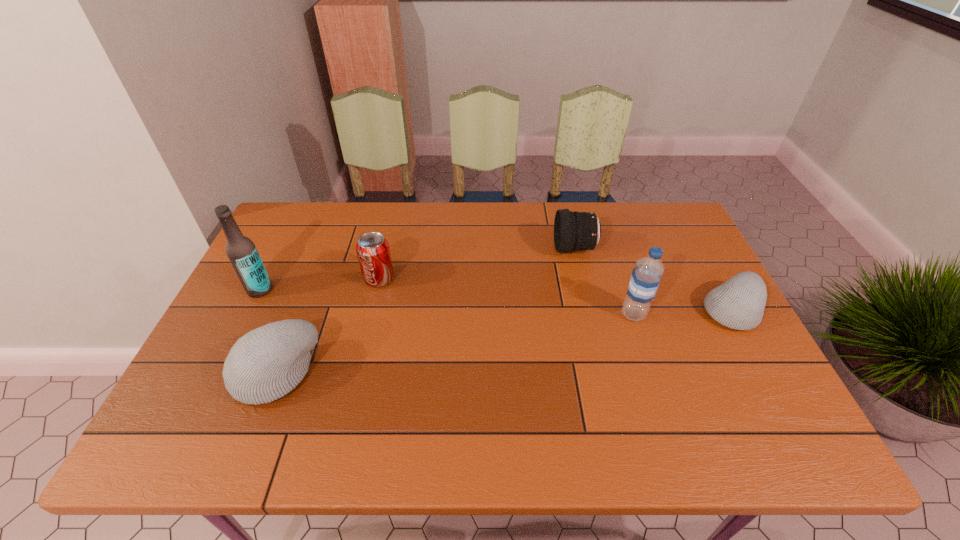
Image resolution: width=960 pixels, height=540 pixels. Find the location of `free space at the far left corner`. free space at the far left corner is located at coordinates (318, 232).

The height and width of the screenshot is (540, 960). I want to click on vacant position at the near left corner of the desktop, so click(216, 393).

The image size is (960, 540). I want to click on vacant space at the far right corner of the desktop, so click(x=645, y=245).

Where is `unoccupied area between the water bottle and the soda can`? The image size is (960, 540). unoccupied area between the water bottle and the soda can is located at coordinates (506, 296).

Find the location of a particular element. The height and width of the screenshot is (540, 960). free space between the tallest object and the second object from right to left is located at coordinates (446, 302).

This screenshot has width=960, height=540. I want to click on unoccupied position between the second tallest object and the rightmost object, so click(x=683, y=312).

Where is `free space between the fifth shortest object and the nearest object`? free space between the fifth shortest object and the nearest object is located at coordinates (454, 343).

Where is `unoccupied area between the third object from left to right and the nearest object`? unoccupied area between the third object from left to right and the nearest object is located at coordinates (327, 326).

At what (x,y) coordinates should I click in order to perform the action: click on vacant area that lies between the tallest object and the soda can. Please return your answer as a coordinate pair (x, y). The height and width of the screenshot is (540, 960). Looking at the image, I should click on (320, 284).

The width and height of the screenshot is (960, 540). I want to click on free space between the beer bottle and the third object from right to left, so click(418, 269).